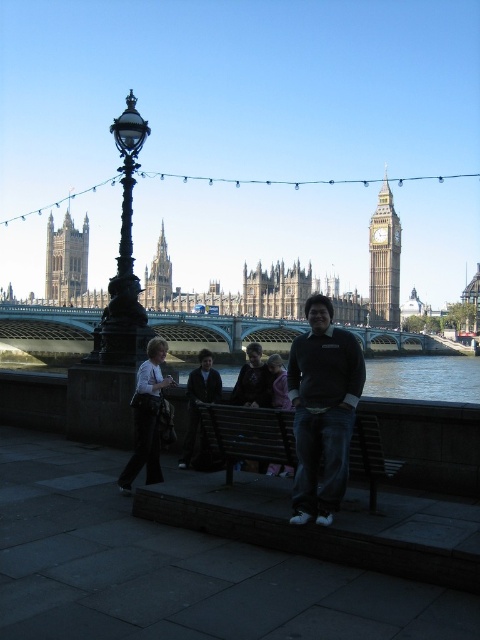
Question: Which point is farther from the camera taking this photo?

Choices:
 (A) (163, 296)
 (B) (124, 221)

Answer: (A)

Question: Which point is farther to the camera?

Choices:
 (A) (59, 237)
 (B) (427, 376)
 (C) (156, 369)

Answer: (A)

Question: Estimate the real-world distances between objects in this image. Which object is closer to the dark blue jeans at center?

Choices:
 (A) golden stone tower at center
 (B) golden stone tower at upper left
 (C) purple fleece jacket at center
 (D) brown wooden bench at center

Answer: (D)

Question: Does matte white shirt at left have a larger size compared to dark brown leather jacket at center?

Choices:
 (A) yes
 (B) no

Answer: (B)

Question: Is gold-colored clock tower at upper right in front of dark brown leather jacket at center?

Choices:
 (A) yes
 (B) no

Answer: (B)

Question: Does dark blue jeans at center appear on the left side of gold-colored clock tower at upper right?

Choices:
 (A) yes
 (B) no

Answer: (A)